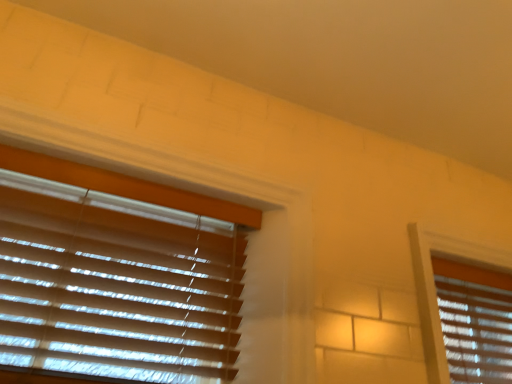
Question: Is wooden blinds at right, the first window blind viewed from the back, oriented towards wooden blinds at left, the 2th window blind when ordered from right to left?

Choices:
 (A) yes
 (B) no

Answer: (B)

Question: Does wooden blinds at right, which is the 1th window blind in right-to-left order, have a lesser width compared to wooden blinds at left, which is the 2th window blind from back to front?

Choices:
 (A) no
 (B) yes

Answer: (A)

Question: From the image's perspective, would you say wooden blinds at right, the first window blind viewed from the back, is shown under wooden blinds at left, which is the 2th window blind from back to front?

Choices:
 (A) yes
 (B) no

Answer: (A)

Question: Does wooden blinds at right, which is the 1th window blind in right-to-left order, come in front of wooden blinds at left, which is the 2th window blind from back to front?

Choices:
 (A) yes
 (B) no

Answer: (B)

Question: Can you confirm if wooden blinds at right, the 2th window blind when ordered from left to right, is shorter than wooden blinds at left, positioned as the 1th window blind in left-to-right order?

Choices:
 (A) yes
 (B) no

Answer: (A)

Question: From a real-world perspective, is wooden blinds at right, the first window blind viewed from the back, on wooden blinds at left, the 2th window blind when ordered from right to left?

Choices:
 (A) yes
 (B) no

Answer: (A)

Question: Can you confirm if wooden blinds at left, positioned as the 1th window blind in left-to-right order, is bigger than wooden blinds at right, the 2th window blind when ordered from left to right?

Choices:
 (A) yes
 (B) no

Answer: (B)

Question: Does wooden blinds at left, the 2th window blind when ordered from right to left, lie in front of wooden blinds at right, which ranks as the second window blind in front-to-back order?

Choices:
 (A) no
 (B) yes

Answer: (B)

Question: Is the surface of wooden blinds at left, which is the 2th window blind from back to front, in direct contact with wooden blinds at right, the first window blind viewed from the back?

Choices:
 (A) yes
 (B) no

Answer: (B)

Question: Is there a large distance between wooden blinds at left, positioned as the 1th window blind in left-to-right order, and wooden blinds at right, the first window blind viewed from the back?

Choices:
 (A) yes
 (B) no

Answer: (A)

Question: From the image's perspective, is wooden blinds at left, which is the 2th window blind from back to front, above wooden blinds at right, the 2th window blind when ordered from left to right?

Choices:
 (A) yes
 (B) no

Answer: (A)

Question: Is wooden blinds at right, which is the 1th window blind in right-to-left order, located within wooden blinds at left, which appears as the 1th window blind when viewed from the front?

Choices:
 (A) no
 (B) yes

Answer: (A)

Question: Is wooden blinds at left, which is the 2th window blind from back to front, situated inside wooden blinds at right, which ranks as the second window blind in front-to-back order, or outside?

Choices:
 (A) inside
 (B) outside

Answer: (B)